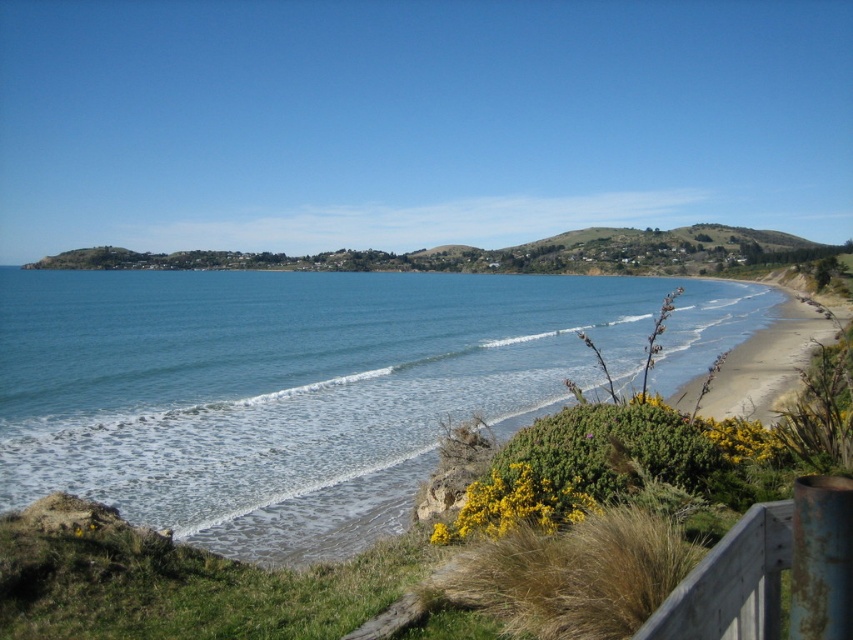
Is blue water at center further to the viewer compared to light brown sandy beach at right?

Yes, it is behind light brown sandy beach at right.

Does point (447, 330) come closer to viewer compared to point (767, 410)?

That is False.

Find the location of a particular element. The image size is (853, 640). blue water at center is located at coordinates (306, 387).